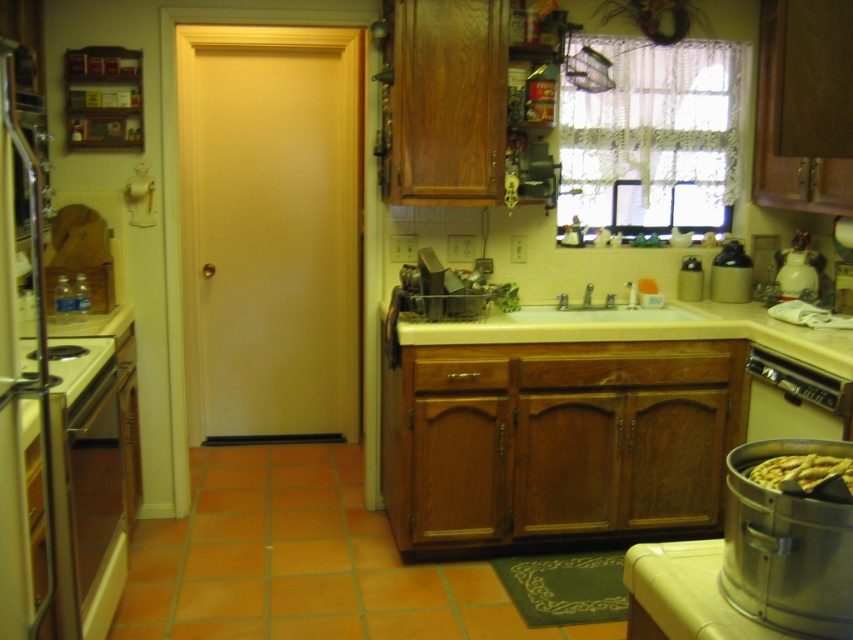
Question: Based on their relative distances, which object is nearer to the stainless steel stove at left?

Choices:
 (A) satin silver dishwasher at lower right
 (B) satin silver oven at lower left

Answer: (B)

Question: Is white marble sink at center smaller than stainless steel stove at left?

Choices:
 (A) no
 (B) yes

Answer: (A)

Question: Does satin silver oven at lower left have a lesser width compared to yellow matte waffle at lower right?

Choices:
 (A) no
 (B) yes

Answer: (A)

Question: Is the position of silver metallic pot at lower right less distant than that of white marble sink at center?

Choices:
 (A) no
 (B) yes

Answer: (B)

Question: Which object is closer to the camera taking this photo?

Choices:
 (A) white marble sink at center
 (B) yellow matte waffle at lower right
 (C) stainless steel stove at left

Answer: (B)

Question: Based on their relative distances, which object is farther from the beige laminate sink at center?

Choices:
 (A) satin silver oven at lower left
 (B) stainless steel stove at left
 (C) white marble sink at center
 (D) white glossy sink at center

Answer: (B)